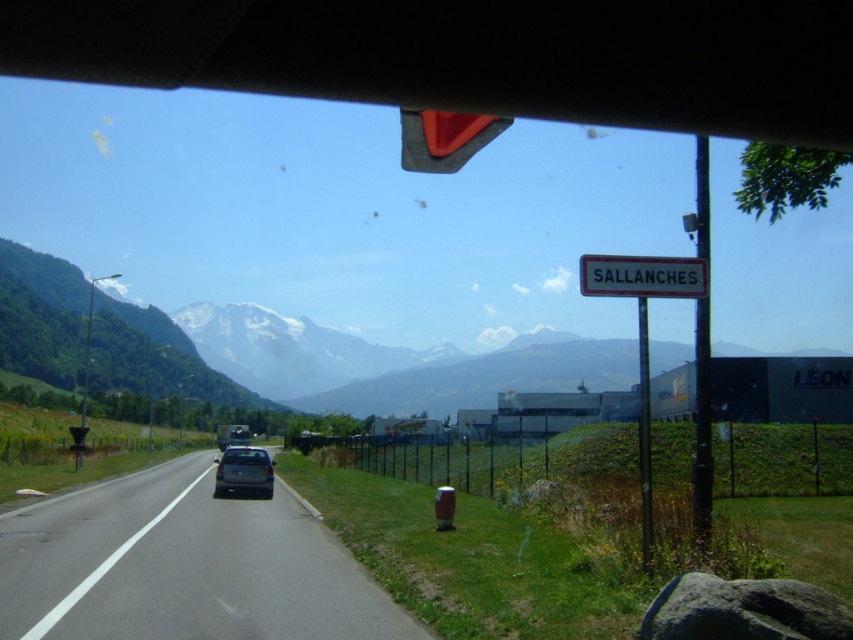
Question: Estimate the real-world distances between objects in this image. Which object is closer to the slate gray metallic car at center?

Choices:
 (A) white plastic sign at right
 (B) white plastic sign at upper center
 (C) smooth asphalt road at center

Answer: (C)

Question: Which point is closer to the camera?

Choices:
 (A) slate gray metallic car at center
 (B) white plastic sign at right
 (C) smooth asphalt road at center
 (D) white plastic sign at upper center

Answer: (C)

Question: Which object appears closest to the camera in this image?

Choices:
 (A) white plastic sign at right
 (B) white plastic sign at upper center
 (C) smooth asphalt road at center

Answer: (C)

Question: Where is smooth asphalt road at center located in relation to slate gray metallic car at center in the image?

Choices:
 (A) right
 (B) left

Answer: (A)

Question: Does smooth asphalt road at center come behind white plastic sign at right?

Choices:
 (A) yes
 (B) no

Answer: (B)

Question: Does white plastic sign at right lie in front of white plastic sign at upper center?

Choices:
 (A) yes
 (B) no

Answer: (A)